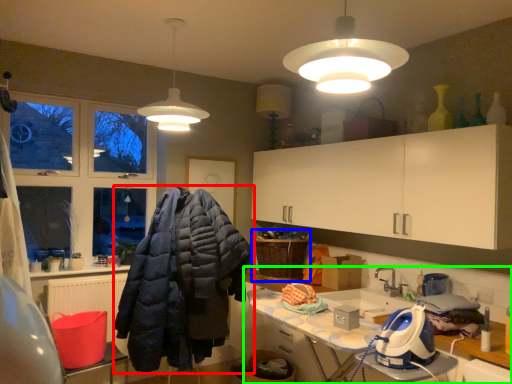
Question: Based on their relative distances, which object is nearer to jacket (highlighted by a red box)? Choose from laundry basket (highlighted by a blue box) and countertop (highlighted by a green box).

Choices:
 (A) laundry basket
 (B) countertop

Answer: (A)